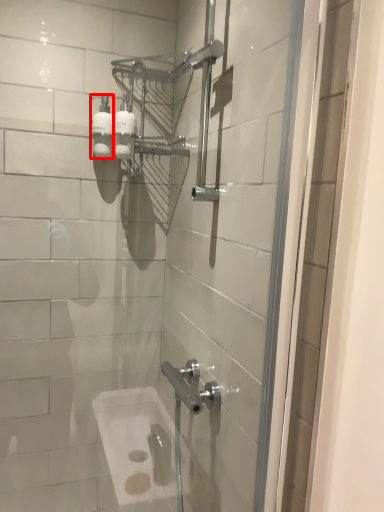
Question: From the image's perspective, what is the correct spatial positioning of toiletry (annotated by the red box) in reference to toiletry?

Choices:
 (A) above
 (B) below

Answer: (A)